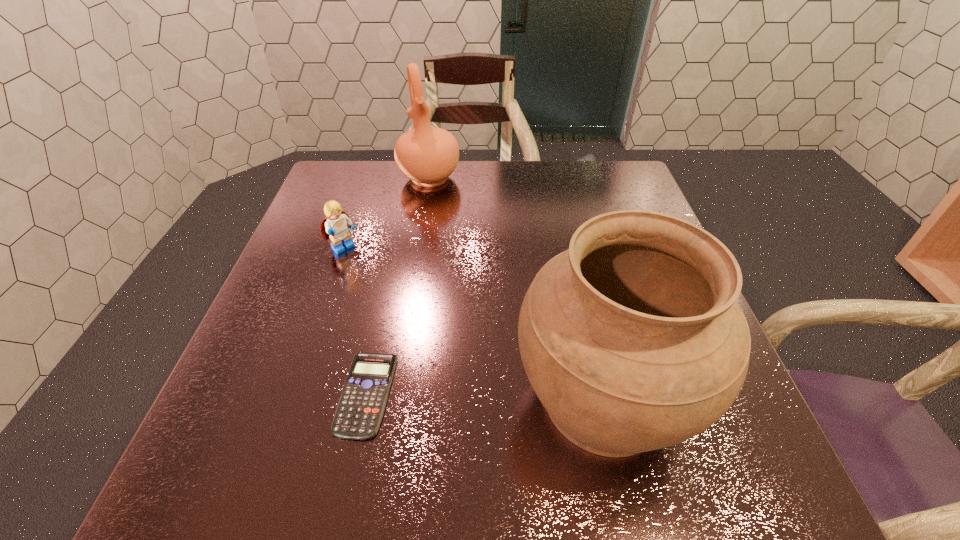
Locate an element on the screen. Image resolution: width=960 pixels, height=540 pixels. blank space located 0.270m on the spout of the farthest object is located at coordinates 449,256.

I want to click on vacant space located on the spout of the farthest object, so click(x=446, y=246).

The image size is (960, 540). Identify the location of free region located on the spout of the farthest object. (449, 256).

At what (x,y) coordinates should I click in order to perform the action: click on object that is at the far edge. Please return your answer as a coordinate pair (x, y). The width and height of the screenshot is (960, 540). Looking at the image, I should click on (427, 155).

The width and height of the screenshot is (960, 540). Find the location of `calculator that is at the near edge`. calculator that is at the near edge is located at coordinates (361, 406).

Locate an element on the screen. This screenshot has height=540, width=960. urn situated at the near edge is located at coordinates (632, 339).

This screenshot has width=960, height=540. In order to click on object that is at the left edge in this screenshot , I will do `click(336, 226)`.

The image size is (960, 540). Find the location of `object at the right edge`. object at the right edge is located at coordinates (632, 339).

Where is `object positioned at the near right corner`? object positioned at the near right corner is located at coordinates (632, 339).

This screenshot has width=960, height=540. In the image, there is a desktop. Find the location of `free space at the far edge`. free space at the far edge is located at coordinates (381, 188).